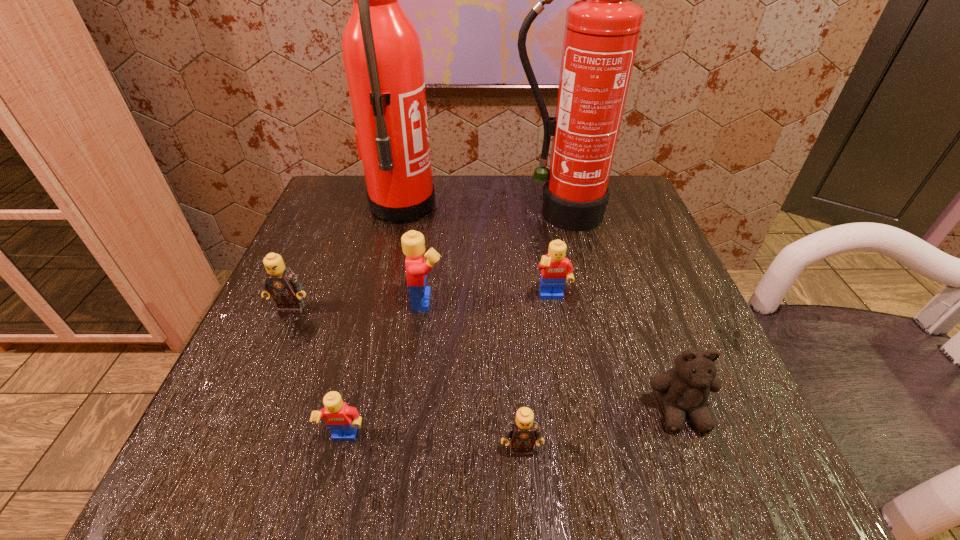
Image resolution: width=960 pixels, height=540 pixels. What are the coordinates of `vacant area that lies between the rightmost yellow Lego and the teddy bear` in the screenshot? It's located at (616, 355).

Identify the location of blank region between the smaller tan Lego and the rightmost Lego. This screenshot has width=960, height=540. (537, 374).

Locate which object ranks seventh in proximity to the tallest Lego. Please provide its 2D coordinates. Your answer should be formatted as a tuple, i.e. [(x, y)], where the tuple contains the x and y coordinates of a point satisfying the conditions above.

[(684, 390)]

Identify which object is the sixth closest to the second biggest yellow Lego. Please provide its 2D coordinates. Your answer should be formatted as a tuple, i.e. [(x, y)], where the tuple contains the x and y coordinates of a point satisfying the conditions above.

[(342, 420)]

Find the location of a particular element. This screenshot has width=960, height=540. Lego identified as the third closest to the second yellow Lego from left to right is located at coordinates (342, 420).

Where is `Lego that is the closest to the fourth Lego from right to left`? This screenshot has width=960, height=540. Lego that is the closest to the fourth Lego from right to left is located at coordinates (522, 431).

The height and width of the screenshot is (540, 960). What are the coordinates of `yellow Lego that is the closest to the bigger tan Lego` in the screenshot? It's located at (413, 243).

Point out which yellow Lego is positioned as the third nearest to the bigger tan Lego. Please provide its 2D coordinates. Your answer should be formatted as a tuple, i.e. [(x, y)], where the tuple contains the x and y coordinates of a point satisfying the conditions above.

[(555, 269)]

This screenshot has height=540, width=960. What are the coordinates of `free space that satisfies the following two spatial constraints: 1. on the face of the biggest yellow Lego; 2. in front of the leftmost object` in the screenshot? It's located at 427,309.